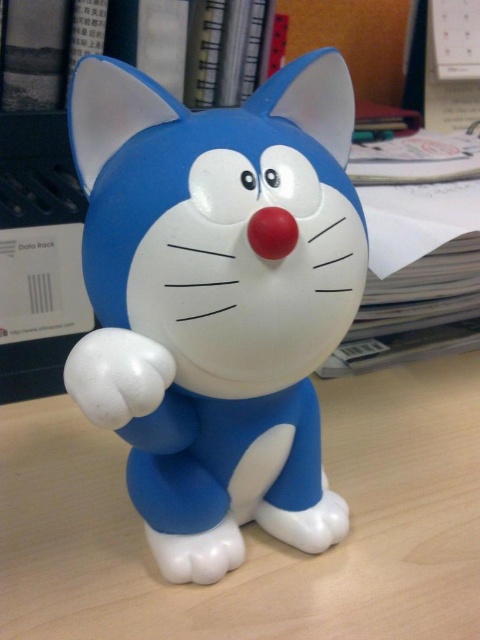
You are organizing a desk space and need to place the blue matte plastic cat at center and the white matte computer desk at center. Which object should you place first to ensure proper arrangement?

You should place the white matte computer desk at center first because the blue matte plastic cat at center is much taller than it, so the desk needs to be positioned to support or accommodate the cat properly.